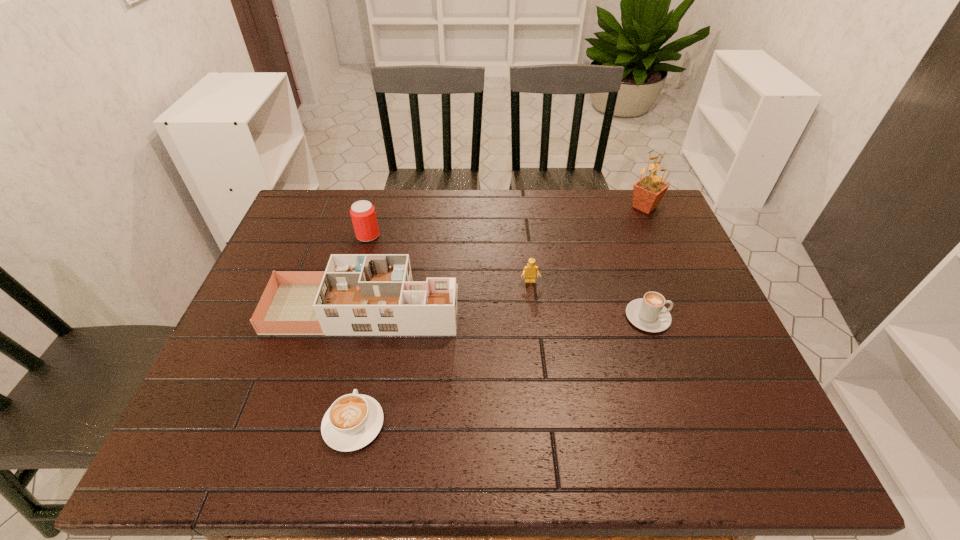
The image size is (960, 540). What are the coordinates of `sunflower that is at the far edge` in the screenshot? It's located at (647, 193).

This screenshot has width=960, height=540. What are the coordinates of `beer can present at the far edge` in the screenshot? It's located at (362, 212).

Locate an element on the screen. object that is at the near edge is located at coordinates (354, 420).

You are a GUI agent. You are given a task and a screenshot of the screen. Output one action in this format:
    pyautogui.click(x=<x>, y=<y>)
    Task: Click on the object that is at the left edge
    The height and width of the screenshot is (540, 960).
    Given the screenshot: What is the action you would take?
    pyautogui.click(x=358, y=294)

This screenshot has height=540, width=960. Find the location of `sunflower present at the right edge`. sunflower present at the right edge is located at coordinates (647, 193).

Find the location of a particular element. This screenshot has height=540, width=960. cappuccino that is at the right edge is located at coordinates (649, 314).

Find the location of `object at the far right corner`. object at the far right corner is located at coordinates (647, 193).

This screenshot has height=540, width=960. Find the location of `free region at the far edge of the desktop`. free region at the far edge of the desktop is located at coordinates (608, 192).

The height and width of the screenshot is (540, 960). I want to click on free space at the near edge of the desktop, so click(x=317, y=447).

I want to click on blank space at the left edge of the desktop, so click(271, 277).